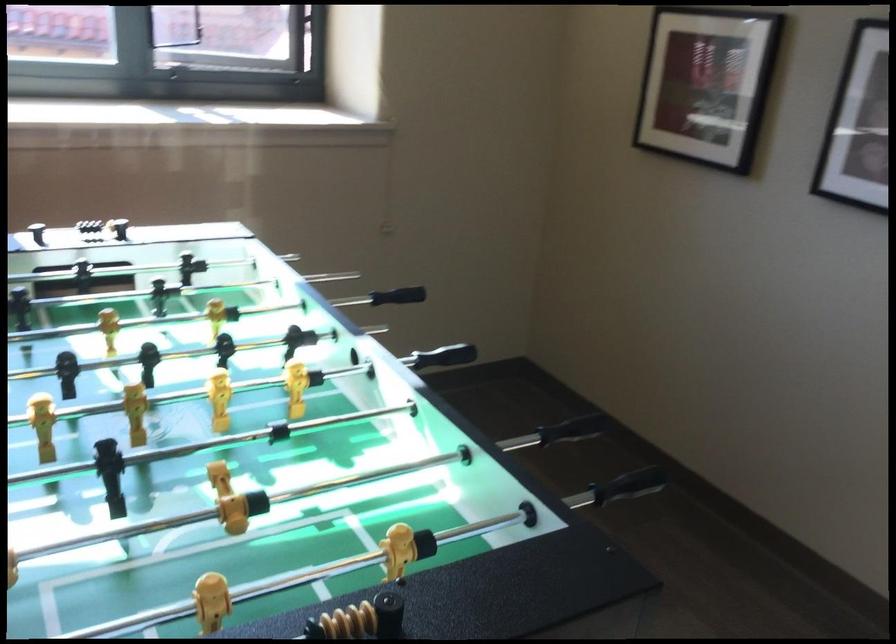
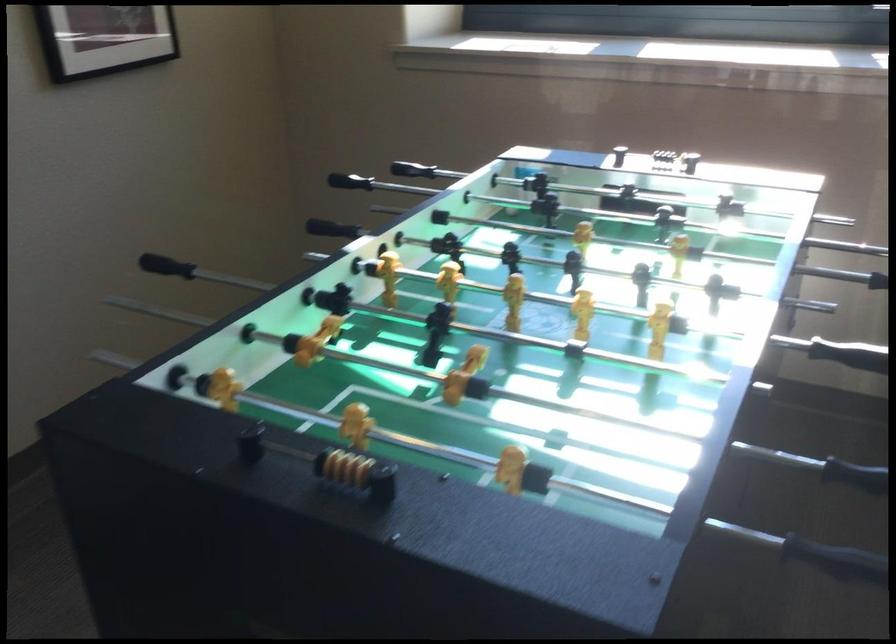
Question: The camera is either moving clockwise (left) or counter-clockwise (right) around the object. The first image is from the beginning of the video and the second image is from the end. Is the camera moving left or right when shooting the video?

Choices:
 (A) Left
 (B) Right

Answer: (B)